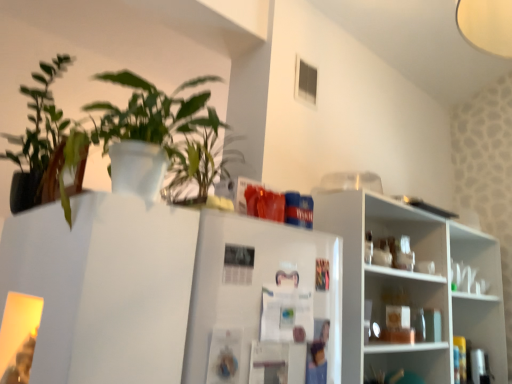
Question: Should I look upward or downward to see white glossy shelves at right, the second shelf in the bottom-to-top sequence?

Choices:
 (A) down
 (B) up

Answer: (A)

Question: From the image's perspective, is white glossy shelves at right, the second shelf in the bottom-to-top sequence, on green matte plant at upper left, marked as the 2th houseplant in a left-to-right arrangement?

Choices:
 (A) yes
 (B) no

Answer: (B)

Question: Can you confirm if white glossy shelves at right, the first shelf positioned from the top, is wider than green matte plant at upper left, marked as the 2th houseplant in a left-to-right arrangement?

Choices:
 (A) yes
 (B) no

Answer: (B)

Question: From the image's perspective, is white glossy shelves at right, the first shelf positioned from the top, under green matte plant at upper left, marked as the 2th houseplant in a left-to-right arrangement?

Choices:
 (A) yes
 (B) no

Answer: (A)

Question: Considering the relative sizes of white glossy shelves at right, the first shelf positioned from the top, and green matte plant at upper left, marked as the 2th houseplant in a left-to-right arrangement, in the image provided, is white glossy shelves at right, the first shelf positioned from the top, smaller than green matte plant at upper left, marked as the 2th houseplant in a left-to-right arrangement,?

Choices:
 (A) yes
 (B) no

Answer: (B)

Question: Considering the relative sizes of white glossy shelves at right, the first shelf positioned from the top, and green matte plant at upper left, marked as the 2th houseplant in a left-to-right arrangement, in the image provided, is white glossy shelves at right, the first shelf positioned from the top, bigger than green matte plant at upper left, marked as the 2th houseplant in a left-to-right arrangement,?

Choices:
 (A) no
 (B) yes

Answer: (B)

Question: Can you confirm if white glossy shelves at right, the second shelf in the bottom-to-top sequence, is shorter than green matte plant at upper left, marked as the 2th houseplant in a left-to-right arrangement?

Choices:
 (A) no
 (B) yes

Answer: (A)

Question: Can you confirm if white glossy shelf at lower right, acting as the 1th shelf starting from the bottom, is bigger than white glossy shelves at right, the second shelf in the bottom-to-top sequence?

Choices:
 (A) no
 (B) yes

Answer: (A)

Question: From the image's perspective, is white glossy shelf at lower right, the 2th shelf viewed from the top, under white glossy shelves at right, the first shelf positioned from the top?

Choices:
 (A) yes
 (B) no

Answer: (A)

Question: Is white glossy shelf at lower right, acting as the 1th shelf starting from the bottom, in front of white glossy shelves at right, the first shelf positioned from the top?

Choices:
 (A) yes
 (B) no

Answer: (B)

Question: Is white glossy shelf at lower right, the 2th shelf viewed from the top, outside of white glossy shelves at right, the first shelf positioned from the top?

Choices:
 (A) yes
 (B) no

Answer: (B)

Question: Considering the relative sizes of white glossy shelf at lower right, acting as the 1th shelf starting from the bottom, and white glossy shelves at right, the first shelf positioned from the top, in the image provided, is white glossy shelf at lower right, acting as the 1th shelf starting from the bottom, taller than white glossy shelves at right, the first shelf positioned from the top,?

Choices:
 (A) no
 (B) yes

Answer: (A)

Question: Is white glossy shelf at lower right, the 2th shelf viewed from the top, touching white glossy shelves at right, the second shelf in the bottom-to-top sequence?

Choices:
 (A) yes
 (B) no

Answer: (B)

Question: Can you confirm if green matte plant at upper left, the 1th houseplant when ordered from right to left, is taller than green matte plant at upper left, marked as the 2th houseplant in a right-to-left arrangement?

Choices:
 (A) yes
 (B) no

Answer: (B)